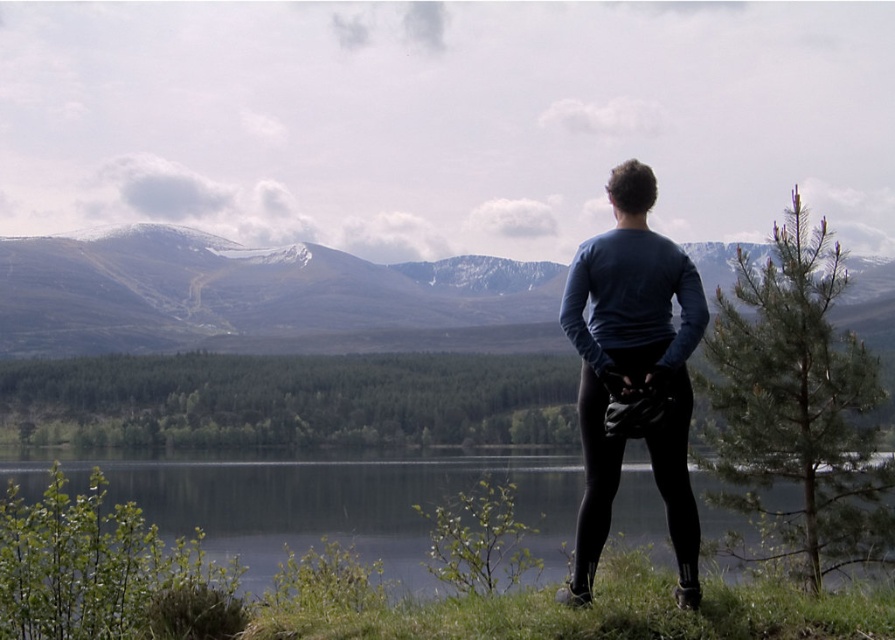
In the scene shown: You are the person in the image looking out at the landscape. You notice two points in the scene. Which point is closer to you, point (299, 461) or point (592, 344)?

Point (299, 461) is closer to you because it is further to the viewer than point (592, 344).

You are standing on the grassy hillside and want to walk towards the sandy brown mountain at center. Which direction should you walk relative to the green grass at lower center?

Since the sandy brown mountain at center is further to the viewer than the green grass at lower center, you should walk away from the green grass at lower center to reach the mountain.